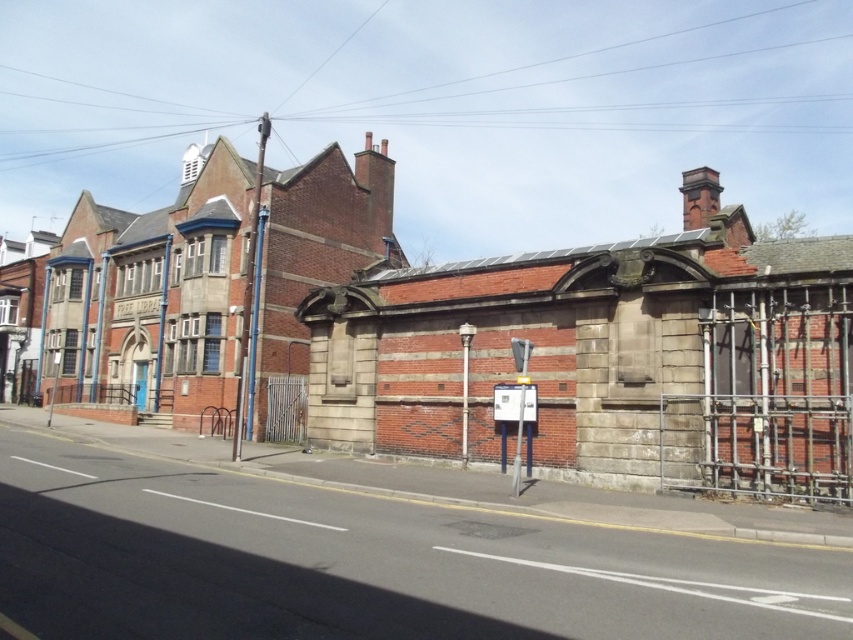
Image resolution: width=853 pixels, height=640 pixels. What do you see at coordinates (776, 394) in the screenshot? I see `metallic scaffolding at right` at bounding box center [776, 394].

Does metallic scaffolding at right appear on the left side of metallic gray sign at center?

In fact, metallic scaffolding at right is to the right of metallic gray sign at center.

Who is more distant from viewer, (x=769, y=492) or (x=514, y=356)?

Point (x=514, y=356)

Where is `metallic scaffolding at right`? Image resolution: width=853 pixels, height=640 pixels. metallic scaffolding at right is located at coordinates (776, 394).